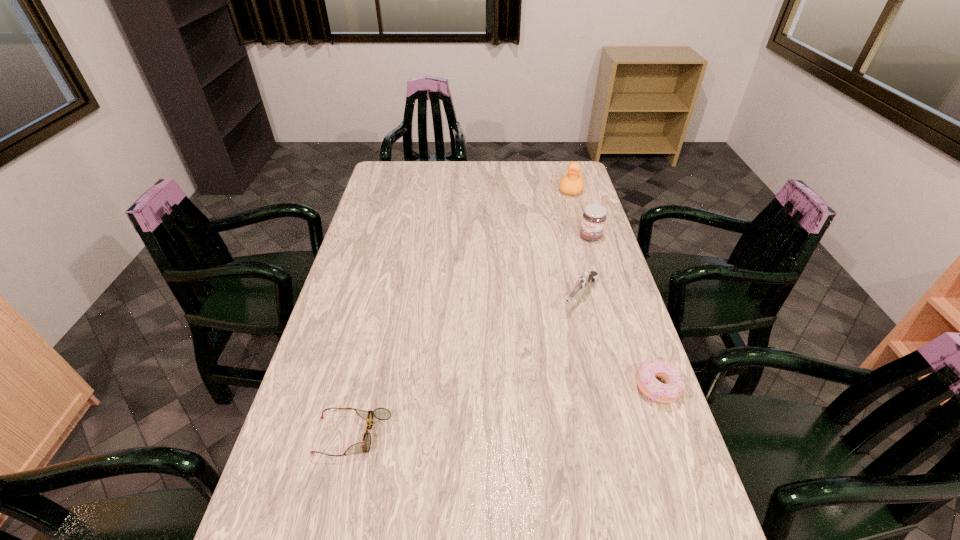
The width and height of the screenshot is (960, 540). Identify the location of blank space located aimed along the barrel of the third shortest object. (544, 349).

This screenshot has width=960, height=540. I want to click on vacant space located aimed along the barrel of the third shortest object, so click(x=521, y=378).

At what (x,y) coordinates should I click in order to perform the action: click on vacant space located 0.080m aimed along the barrel of the third shortest object. Please return your answer as a coordinate pair (x, y). The height and width of the screenshot is (540, 960). Looking at the image, I should click on (559, 329).

You are a GUI agent. You are given a task and a screenshot of the screen. Output one action in this format:
    pyautogui.click(x=<x>, y=<y>)
    Task: Click on the vacant area located on the face of the farthest object
    The height and width of the screenshot is (540, 960).
    Given the screenshot: What is the action you would take?
    pyautogui.click(x=561, y=229)

This screenshot has width=960, height=540. I want to click on free space located 0.240m on the face of the farthest object, so click(x=561, y=231).

Identify the location of free space located 0.280m on the face of the farthest object. The width and height of the screenshot is (960, 540). (559, 237).

The image size is (960, 540). Find the location of `blank space located on the front label of the fourth nearest object`. blank space located on the front label of the fourth nearest object is located at coordinates (540, 312).

Identify the location of vacant space located on the front label of the fourth nearest object. (549, 298).

This screenshot has width=960, height=540. I want to click on free space located on the front label of the fourth nearest object, so click(x=562, y=280).

Find the location of a particular element. object positioned at the far edge is located at coordinates (572, 183).